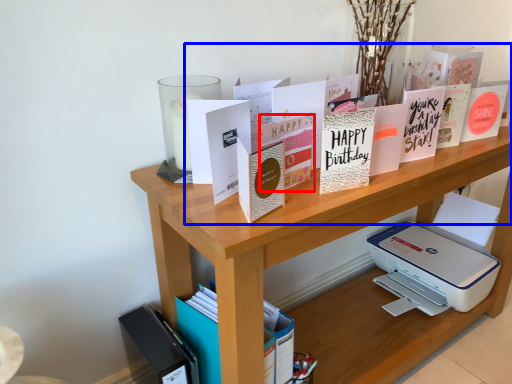
Question: Which of the following is the closest to the observer, paperback book (highlighted by a red box) or book (highlighted by a blue box)?

Choices:
 (A) paperback book
 (B) book

Answer: (B)